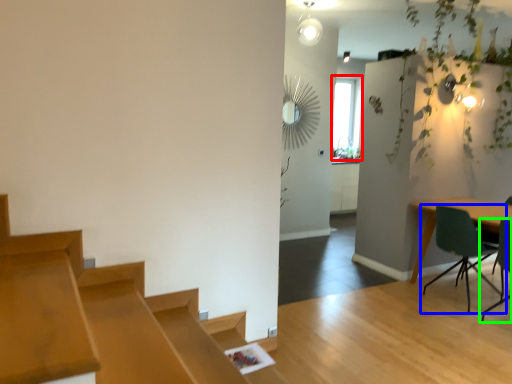
Question: Which is farther away from window (highlighted by a red box)? chair (highlighted by a blue box) or chair (highlighted by a green box)?

Choices:
 (A) chair
 (B) chair

Answer: (B)